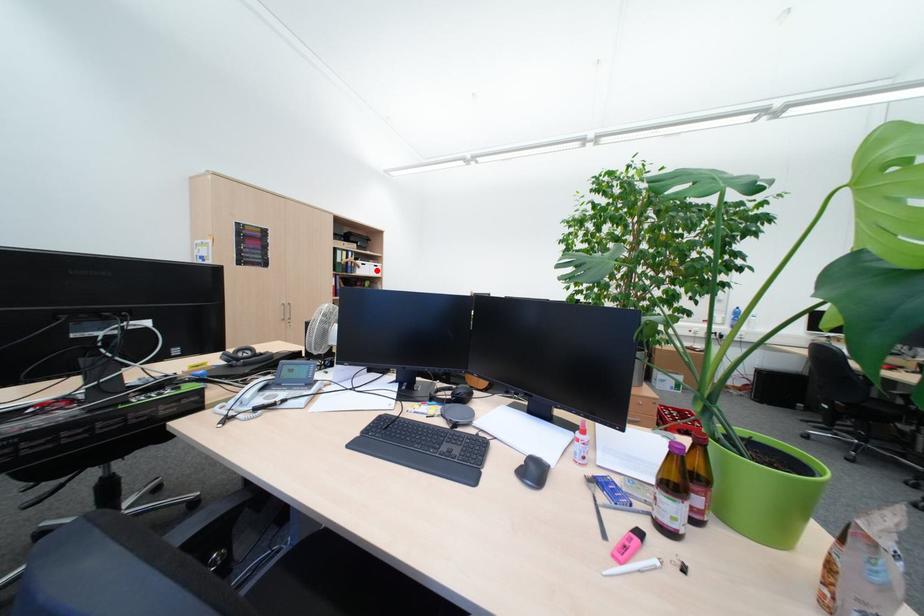
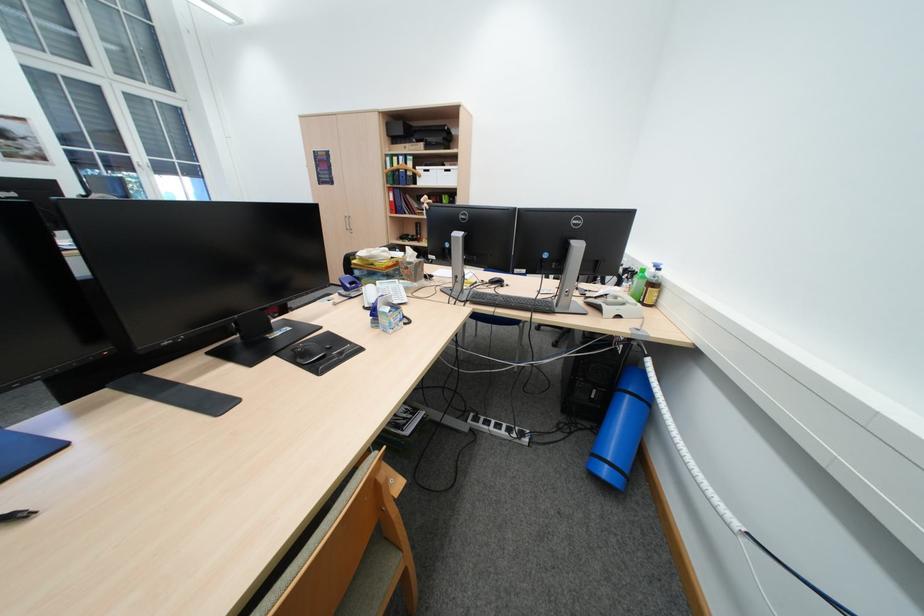
Locate, in the second image, the point that corresponds to the highlighted location in the first image.

(442, 179)